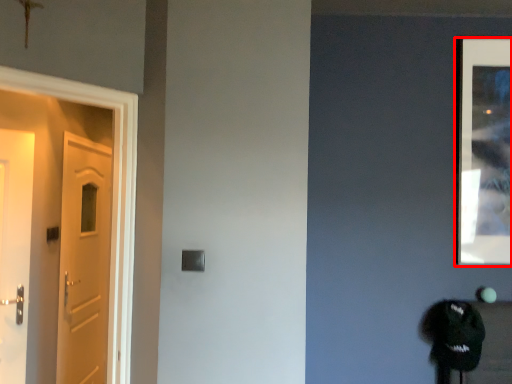
Question: From the image's perspective, where is picture frame (annotated by the red box) located in relation to door in the image?

Choices:
 (A) below
 (B) above

Answer: (B)